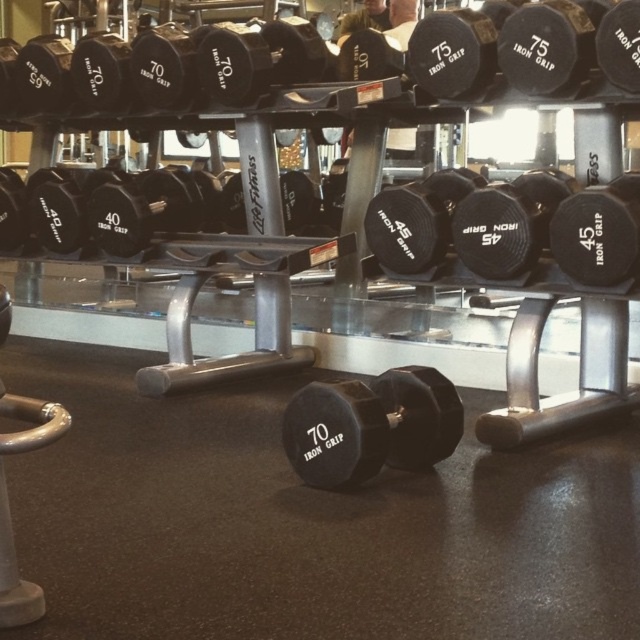
Question: Can you confirm if black rubber dumbbells at upper center is positioned below black rubber dumbbell at center?

Choices:
 (A) yes
 (B) no

Answer: (B)

Question: Can you confirm if black rubber dumbbells at upper center is wider than black rubber dumbbell at center?

Choices:
 (A) yes
 (B) no

Answer: (A)

Question: Observing the image, what is the correct spatial positioning of black rubber dumbbells at upper center in reference to black rubber dumbbell at center?

Choices:
 (A) above
 (B) below

Answer: (A)

Question: Which point appears farthest from the camera in this image?

Choices:
 (A) (438, 58)
 (B) (388, 452)

Answer: (A)